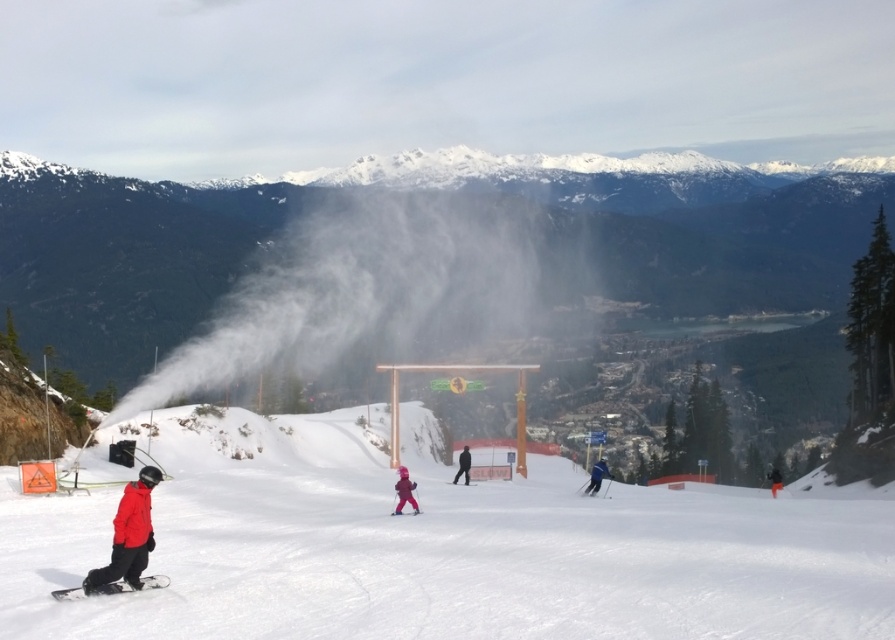
You are a photographer standing at the bottom of the slope. You want to capture a photo that includes both the orange snowsuit at lower right and the matte blue ski at center. Which object will appear bigger in the photo?

The orange snowsuit at lower right will appear bigger in the photo because it is larger in size than the matte blue ski at center.

You are a photographer standing at the camera position. You want to capture a closeup of the matte red snowboard at lower left. Can you reach it without moving your camera position? The maximum distance your camera can focus is 180 feet.

The matte red snowboard at lower left is 183.45 feet from the camera, which is beyond the camera focus range of 180 feet. You cannot capture a closeup without moving the camera closer.